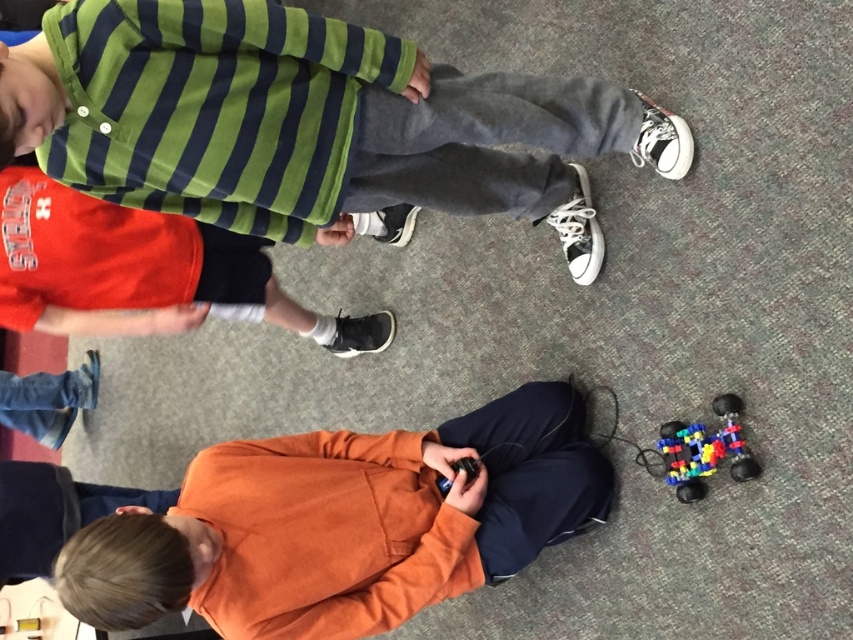
You are a child sitting on the floor holding a small black object. You see two points in the room, point A at coordinates point (390,125) and point B at coordinates point (697,444). Which point is closer to you?

Point A at coordinates point (390,125) is closer to you because it is in front of point B at coordinates point (697,444).

You are a teacher observing the robotics activity. You notice the matte green striped shirt at upper left and the multicolored plastic toy car at lower right. Which object is bigger in size?

The matte green striped shirt at upper left is larger in size compared to the multicolored plastic toy car at lower right.

You are a teacher observing the robotics activity. You need to identify which child is closer to the front of the image based on their clothing. The children are wearing a matte green striped shirt at upper left and an orange fleece shirt at lower center. Which child is positioned closer to the front?

The orange fleece shirt at lower center is positioned closer to the front of the image because it is located at the lower center, which is typically closer to the viewer compared to the upper left position.